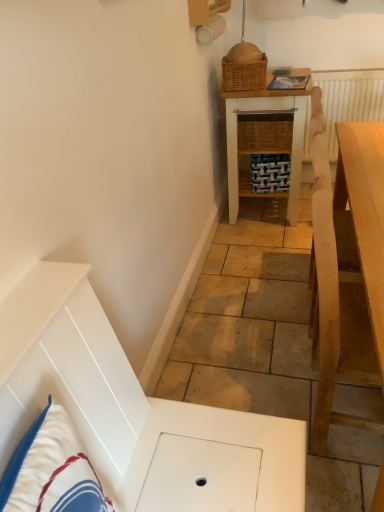
Question: Considering the relative sizes of white textured radiator at upper right and woven brown picnic basket at upper center in the image provided, is white textured radiator at upper right wider than woven brown picnic basket at upper center?

Choices:
 (A) yes
 (B) no

Answer: (B)

Question: From the image's perspective, is white textured radiator at upper right below woven brown picnic basket at upper center?

Choices:
 (A) yes
 (B) no

Answer: (A)

Question: From the image's perspective, is white textured radiator at upper right above woven brown picnic basket at upper center?

Choices:
 (A) no
 (B) yes

Answer: (A)

Question: Can you confirm if white textured radiator at upper right is taller than woven brown picnic basket at upper center?

Choices:
 (A) yes
 (B) no

Answer: (A)

Question: From a real-world perspective, is white textured radiator at upper right positioned under woven brown picnic basket at upper center based on gravity?

Choices:
 (A) no
 (B) yes

Answer: (B)

Question: Is white textured radiator at upper right in contact with woven brown picnic basket at upper center?

Choices:
 (A) no
 (B) yes

Answer: (A)

Question: Are woven brown picnic basket at upper center and white textured radiator at upper right far apart?

Choices:
 (A) yes
 (B) no

Answer: (B)

Question: Are woven brown picnic basket at upper center and white textured radiator at upper right beside each other?

Choices:
 (A) yes
 (B) no

Answer: (B)

Question: Does woven brown picnic basket at upper center have a larger size compared to white textured radiator at upper right?

Choices:
 (A) yes
 (B) no

Answer: (B)

Question: From a real-world perspective, is woven brown picnic basket at upper center positioned over white textured radiator at upper right based on gravity?

Choices:
 (A) no
 (B) yes

Answer: (B)

Question: Does woven brown picnic basket at upper center appear on the left side of white textured radiator at upper right?

Choices:
 (A) no
 (B) yes

Answer: (B)

Question: Does woven brown picnic basket at upper center have a lesser width compared to white textured radiator at upper right?

Choices:
 (A) yes
 (B) no

Answer: (B)

Question: From a real-world perspective, is woven wood table at center, the 1th table when ordered from top to bottom, located beneath woven brown picnic basket at upper center?

Choices:
 (A) yes
 (B) no

Answer: (A)